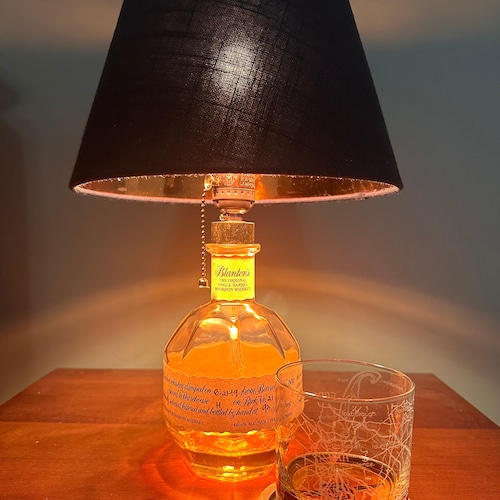
The image size is (500, 500). Find the location of `lampshade`. lampshade is located at coordinates (223, 75).